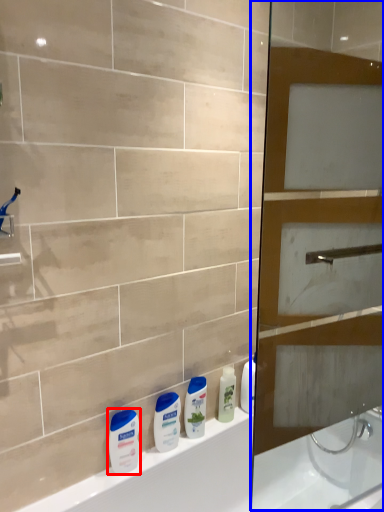
Question: Which object appears farthest to the camera in this image, toiletry (highlighted by a red box) or screen door (highlighted by a blue box)?

Choices:
 (A) toiletry
 (B) screen door

Answer: (A)